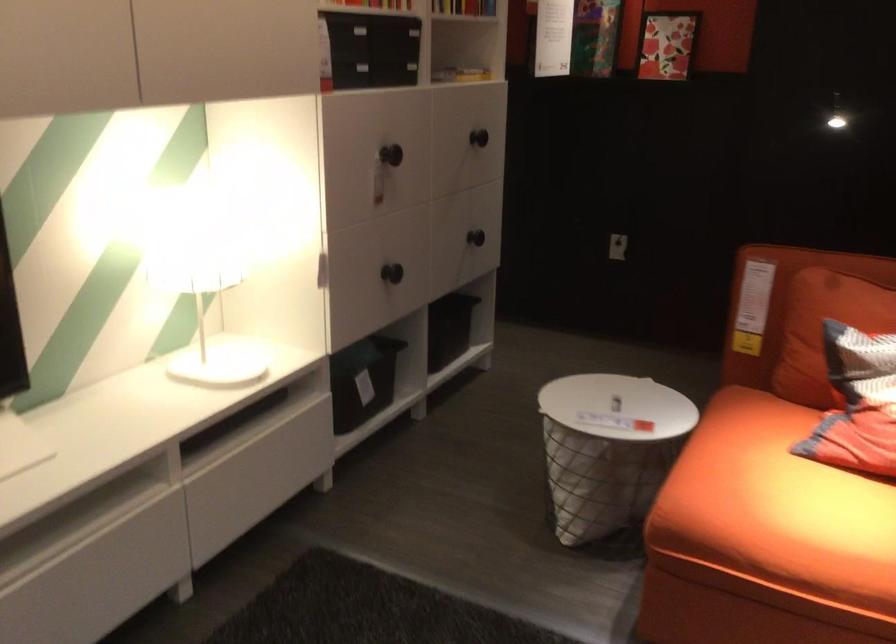
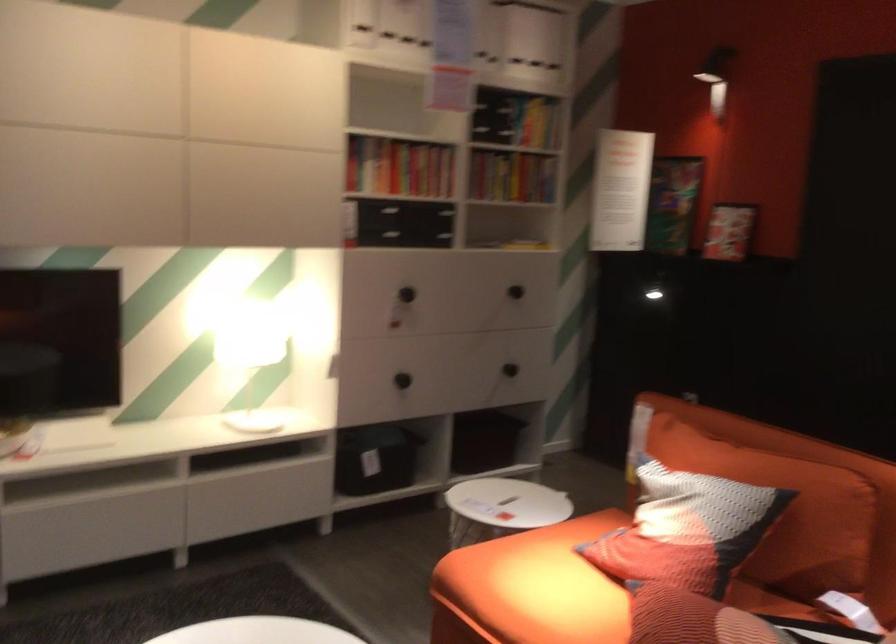
Where in the second image is the point corresponding to point 478,82 from the first image?

(524, 245)